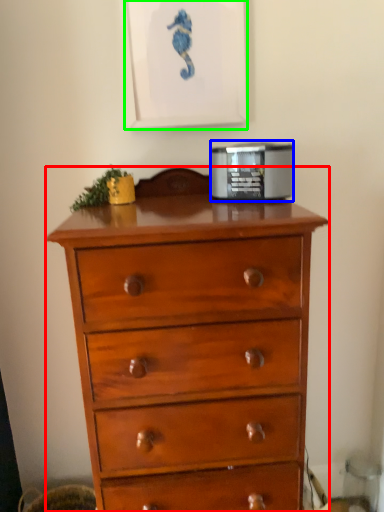
Question: Estimate the real-world distances between objects in this image. Which object is closer to chest of drawers (highlighted by a red box), appliance (highlighted by a blue box) or picture frame (highlighted by a green box)?

Choices:
 (A) appliance
 (B) picture frame

Answer: (A)